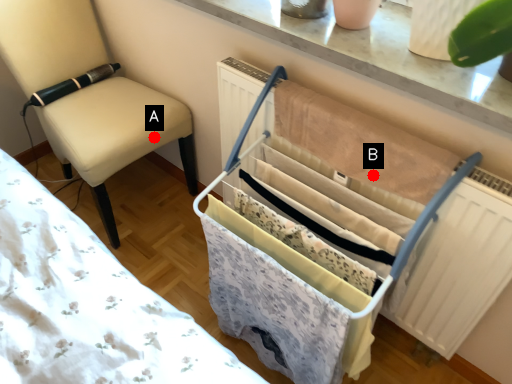
Question: Two points are circled on the image, labeled by A and B beside each circle. Which of the following is the closest to the observer?

Choices:
 (A) A is closer
 (B) B is closer

Answer: (B)